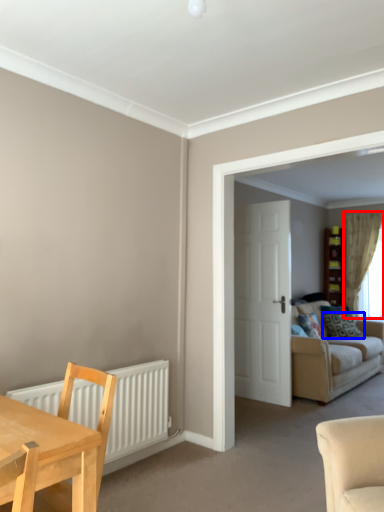
Question: Which point is further to the camera, curtain (highlighted by a red box) or pillow (highlighted by a blue box)?

Choices:
 (A) curtain
 (B) pillow

Answer: (A)